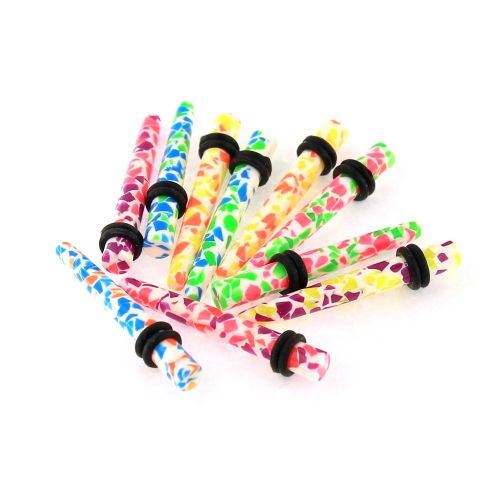
Image resolution: width=500 pixels, height=500 pixels. I want to click on blue and orange plug, so click(117, 315).